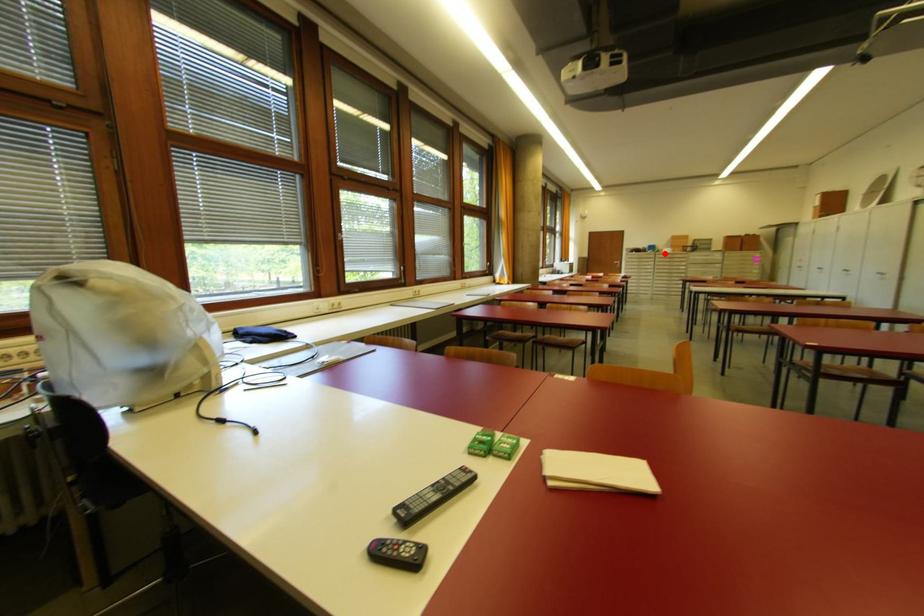
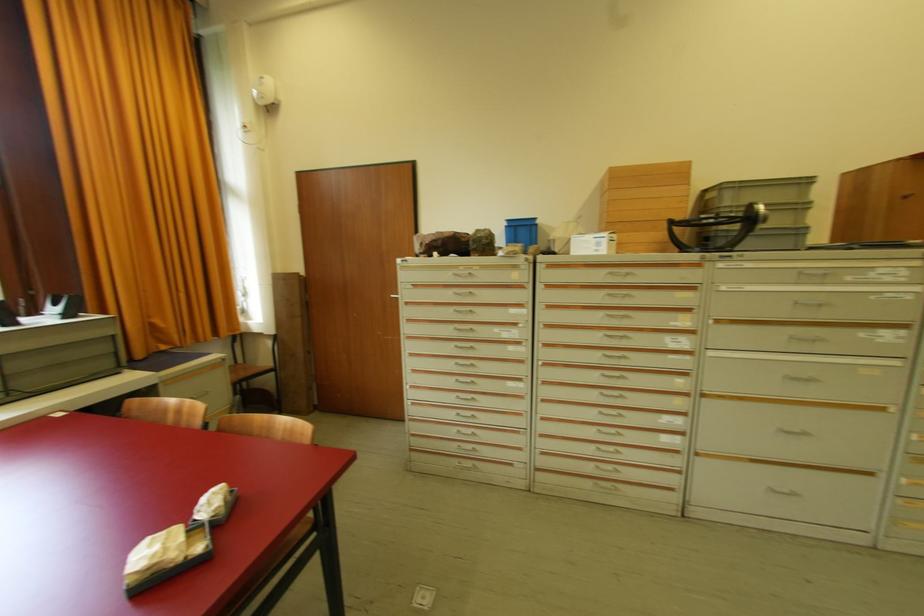
The point at the highlighted location is marked in the first image. Where is the corresponding point in the second image?

(570, 254)